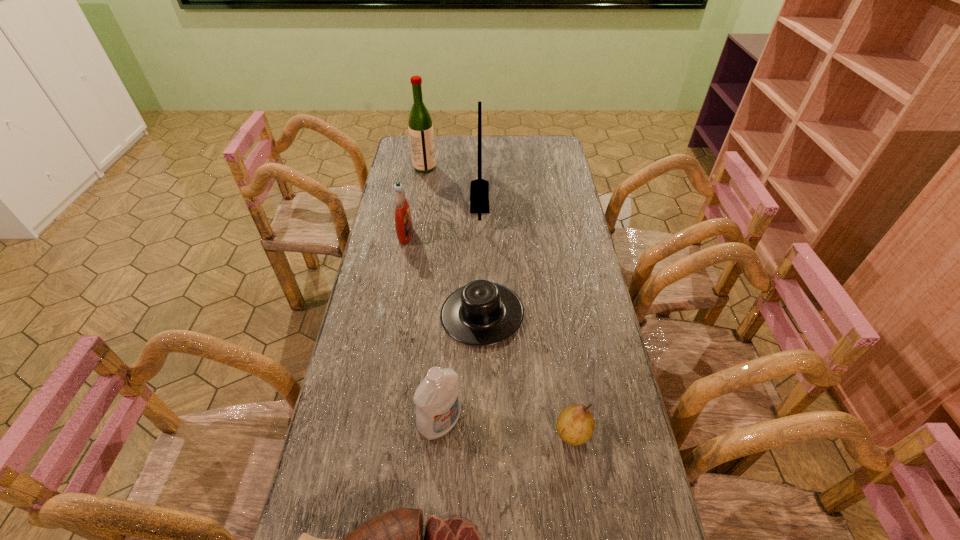
Locate an element on the screen. liquor is located at coordinates (421, 134).

At what (x,y) coordinates should I click in order to perform the action: click on the second tallest object. Please return your answer as a coordinate pair (x, y). Looking at the image, I should click on (479, 190).

What are the coordinates of `the right detergent` in the screenshot? It's located at (438, 405).

Image resolution: width=960 pixels, height=540 pixels. I want to click on the left detergent, so pos(403,220).

Find the location of `the rightmost object`. the rightmost object is located at coordinates (575, 425).

Where is `the shortest object`? the shortest object is located at coordinates (481, 313).

Locate an element on the screen. dress hat is located at coordinates (481, 313).

At what (x,y) coordinates should I click in order to perform the action: click on vacant area located on the label of the tallest object. Please return your answer as a coordinate pair (x, y). Image resolution: width=960 pixels, height=540 pixels. Looking at the image, I should click on (516, 167).

You are a GUI agent. You are given a task and a screenshot of the screen. Output one action in this format:
    pyautogui.click(x=<x>, y=<y>)
    Task: Click on the free space located on the front-facing side of the monitor
    
    Given the screenshot: What is the action you would take?
    pyautogui.click(x=555, y=197)

Identify the location of vacant space located 0.290m on the back of the nearer detergent. This screenshot has height=540, width=960. (447, 318).